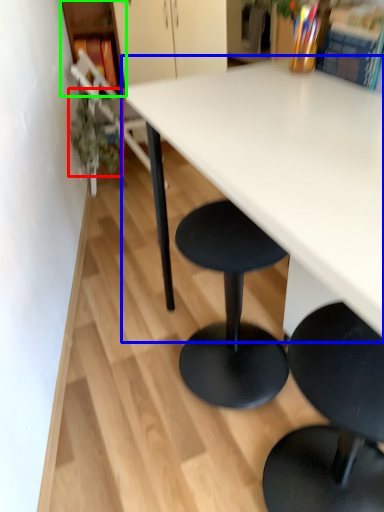
Question: Based on their relative distances, which object is farther from plant (highlighted by a red box)? Choose from table (highlighted by a blue box) and shelf (highlighted by a green box).

Choices:
 (A) table
 (B) shelf

Answer: (A)